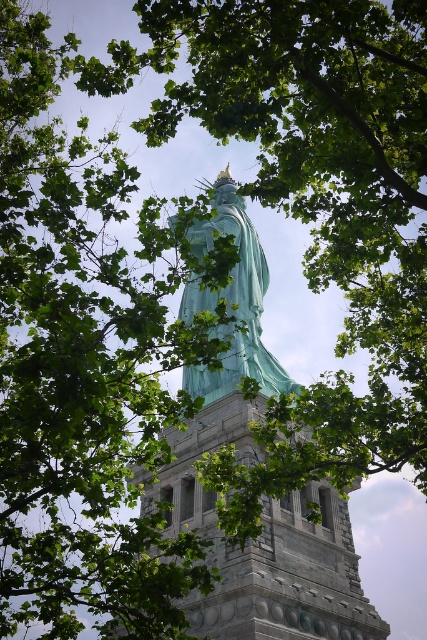
You are taking a photo of the Statue of Liberty and want to focus on both the point at coordinates point (286, 605) and point (262, 282). Which point should you focus on first to ensure both are in sharp focus?

You should focus on point (286, 605) first because it is closer to the camera than point (262, 282), ensuring both points are within the depth of field.

You are a tourist visiting the Statue of Liberty. You notice two green structures at the center of the scene. Which one is taller? Please refer to the green stone tower at center and the green patina statue at center in your answer.

The green patina statue at center is taller than the green stone tower at center.

You are a tourist standing in front of the Statue of Liberty. You notice the green stone tower at center and the green patina statue at center. Which object is closer to you?

The green stone tower at center is closer to you because it is positioned in front of the green patina statue at center.